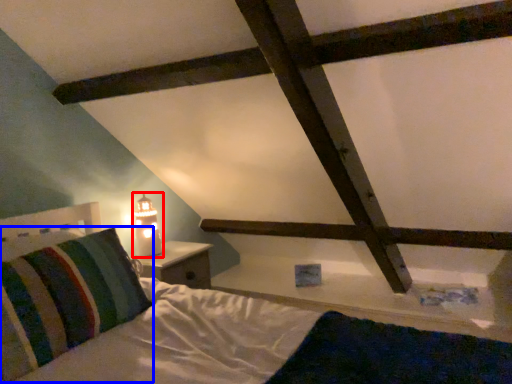
Question: Which object is closer to the camera taking this photo, table lamp (highlighted by a red box) or pillow (highlighted by a blue box)?

Choices:
 (A) table lamp
 (B) pillow

Answer: (B)